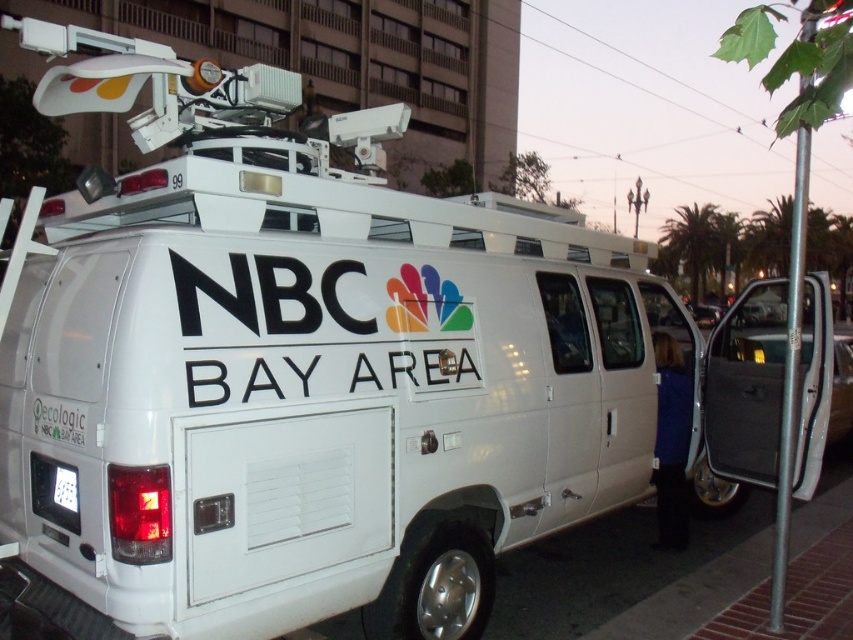
Question: Does white plastic license plate at lower left appear over white plastic license plate at rear?

Choices:
 (A) yes
 (B) no

Answer: (B)

Question: Which of the following is the farthest from the observer?

Choices:
 (A) (67, 477)
 (B) (59, 499)

Answer: (B)

Question: Observing the image, what is the correct spatial positioning of white plastic license plate at lower left in reference to white plastic license plate at rear?

Choices:
 (A) right
 (B) left

Answer: (B)

Question: Is white plastic license plate at lower left to the left of white plastic license plate at rear from the viewer's perspective?

Choices:
 (A) yes
 (B) no

Answer: (A)